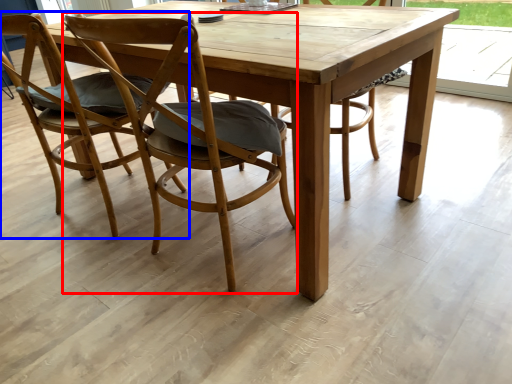
Question: Which point is closer to the camera, chair (highlighted by a red box) or chair (highlighted by a blue box)?

Choices:
 (A) chair
 (B) chair

Answer: (A)